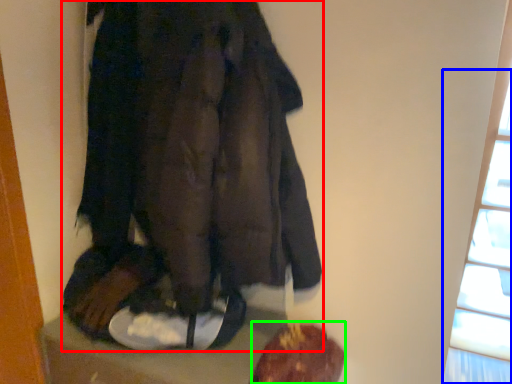
Question: Considering the real-world distances, which object is closest to fancy dress (highlighted by a red box)? window (highlighted by a blue box) or food (highlighted by a green box).

Choices:
 (A) window
 (B) food

Answer: (B)